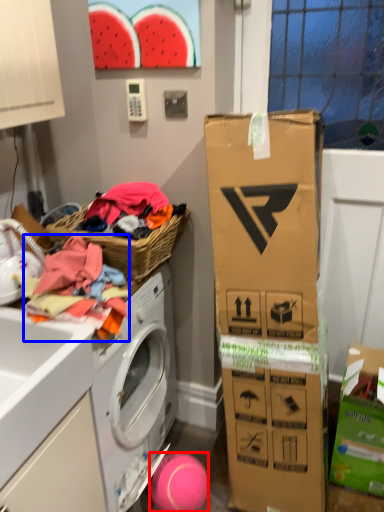
Question: Which object appears closest to the camera in this image, ball (highlighted by a red box) or clothing (highlighted by a blue box)?

Choices:
 (A) ball
 (B) clothing

Answer: (B)